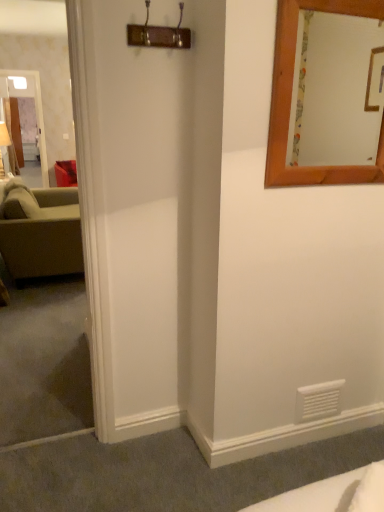
Question: Can you confirm if green fabric couch at left is positioned to the left of wooden-framed mirror at upper right?

Choices:
 (A) yes
 (B) no

Answer: (A)

Question: Is green fabric couch at left to the right of wooden-framed mirror at upper right from the viewer's perspective?

Choices:
 (A) no
 (B) yes

Answer: (A)

Question: Is green fabric couch at left thinner than wooden-framed mirror at upper right?

Choices:
 (A) yes
 (B) no

Answer: (B)

Question: Is green fabric couch at left next to wooden-framed mirror at upper right and touching it?

Choices:
 (A) no
 (B) yes

Answer: (A)

Question: From a real-world perspective, is green fabric couch at left physically below wooden-framed mirror at upper right?

Choices:
 (A) no
 (B) yes

Answer: (B)

Question: Is wooden-framed mirror at upper right wider or thinner than green fabric couch at left?

Choices:
 (A) wide
 (B) thin

Answer: (B)

Question: Choose the correct answer: Is wooden-framed mirror at upper right inside green fabric couch at left or outside it?

Choices:
 (A) outside
 (B) inside

Answer: (A)

Question: In the image, is wooden-framed mirror at upper right positioned in front of or behind green fabric couch at left?

Choices:
 (A) front
 (B) behind

Answer: (A)

Question: From the image's perspective, relative to green fabric couch at left, is wooden-framed mirror at upper right above or below?

Choices:
 (A) below
 (B) above

Answer: (B)

Question: Is wooden-framed mirror at upper right inside or outside of clear glass door at left?

Choices:
 (A) outside
 (B) inside

Answer: (A)

Question: Is point (377, 117) positioned closer to the camera than point (29, 86)?

Choices:
 (A) closer
 (B) farther

Answer: (A)

Question: Is wooden-framed mirror at upper right taller or shorter than clear glass door at left?

Choices:
 (A) tall
 (B) short

Answer: (B)

Question: From the image's perspective, is wooden-framed mirror at upper right positioned above or below clear glass door at left?

Choices:
 (A) above
 (B) below

Answer: (B)

Question: Considering the positions of green fabric couch at left and wooden-framed mirror at upper right in the image, is green fabric couch at left wider or thinner than wooden-framed mirror at upper right?

Choices:
 (A) thin
 (B) wide

Answer: (B)

Question: Based on their positions, is green fabric couch at left located to the left or right of wooden-framed mirror at upper right?

Choices:
 (A) left
 (B) right

Answer: (A)